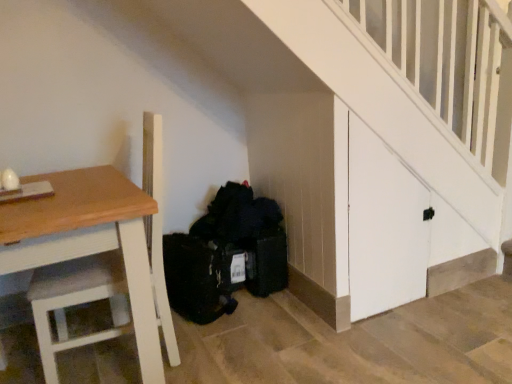
Question: Is black fabric bag at lower center taller or shorter than wooden table at left?

Choices:
 (A) tall
 (B) short

Answer: (B)

Question: From a real-world perspective, is black fabric bag at lower center positioned above or below wooden table at left?

Choices:
 (A) below
 (B) above

Answer: (A)

Question: Considering their positions, is black fabric bag at lower center located in front of or behind wooden table at left?

Choices:
 (A) behind
 (B) front

Answer: (A)

Question: In terms of width, does wooden table at left look wider or thinner when compared to black fabric bag at lower center?

Choices:
 (A) thin
 (B) wide

Answer: (B)

Question: In the image, is wooden table at left on the left side or the right side of black fabric bag at lower center?

Choices:
 (A) right
 (B) left

Answer: (B)

Question: Is point (96, 233) positioned closer to the camera than point (221, 203)?

Choices:
 (A) closer
 (B) farther

Answer: (A)

Question: Which is correct: wooden table at left is inside black fabric bag at lower center, or outside of it?

Choices:
 (A) inside
 (B) outside

Answer: (B)